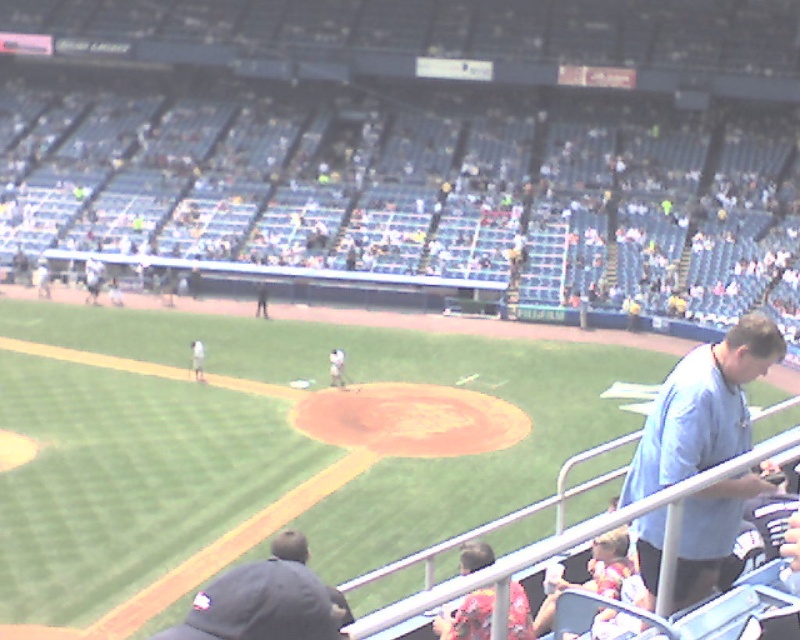
Question: Observing the image, what is the correct spatial positioning of light blue seats at upper center in reference to light blue shirt at right?

Choices:
 (A) above
 (B) below

Answer: (A)

Question: Which point is closer to the camera?

Choices:
 (A) (641, 156)
 (B) (278, 548)

Answer: (B)

Question: Which of the following is the farthest from the observer?

Choices:
 (A) (417, 166)
 (B) (766, 342)
 (C) (332, 596)

Answer: (A)

Question: Which object is the farthest from the dark gray baseball cap at lower left?

Choices:
 (A) light blue seats at upper center
 (B) light blue shirt at right

Answer: (A)

Question: Is light blue seats at upper center bigger than dark gray baseball cap at lower left?

Choices:
 (A) no
 (B) yes

Answer: (B)

Question: From the image, what is the correct spatial relationship of light blue shirt at right in relation to dark gray baseball cap at lower left?

Choices:
 (A) right
 (B) left

Answer: (A)